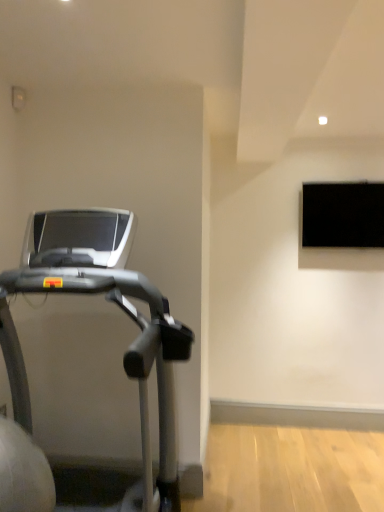
Question: From the image's perspective, is black matte tv at upper right located above or below silver metallic treadmill at left?

Choices:
 (A) above
 (B) below

Answer: (A)

Question: Considering the positions of black matte tv at upper right and silver metallic treadmill at left in the image, is black matte tv at upper right taller or shorter than silver metallic treadmill at left?

Choices:
 (A) tall
 (B) short

Answer: (B)

Question: Which is correct: black matte tv at upper right is inside silver metallic treadmill at left, or outside of it?

Choices:
 (A) inside
 (B) outside

Answer: (B)

Question: Considering the relative positions of silver metallic treadmill at left and black matte tv at upper right in the image provided, is silver metallic treadmill at left to the left or to the right of black matte tv at upper right?

Choices:
 (A) left
 (B) right

Answer: (A)

Question: From a real-world perspective, is silver metallic treadmill at left above or below black matte tv at upper right?

Choices:
 (A) above
 (B) below

Answer: (B)

Question: In the image, is silver metallic treadmill at left positioned in front of or behind black matte tv at upper right?

Choices:
 (A) behind
 (B) front

Answer: (B)

Question: From the image's perspective, is silver metallic treadmill at left located above or below black matte tv at upper right?

Choices:
 (A) below
 (B) above

Answer: (A)